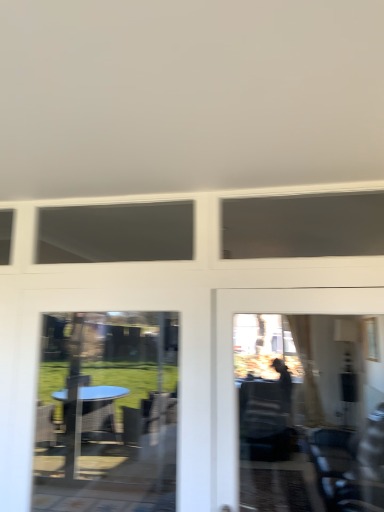
Question: Which is correct: transparent glass table at lower left is inside matte glass door at right, or outside of it?

Choices:
 (A) outside
 (B) inside

Answer: (A)

Question: Considering the positions of transparent glass table at lower left and matte glass door at right in the image, is transparent glass table at lower left bigger or smaller than matte glass door at right?

Choices:
 (A) big
 (B) small

Answer: (B)

Question: Visually, is transparent glass table at lower left positioned to the left or to the right of matte glass door at right?

Choices:
 (A) left
 (B) right

Answer: (A)

Question: From the image's perspective, is matte glass door at right positioned above or below transparent glass table at lower left?

Choices:
 (A) below
 (B) above

Answer: (B)

Question: Considering the positions of matte glass door at right and transparent glass table at lower left in the image, is matte glass door at right taller or shorter than transparent glass table at lower left?

Choices:
 (A) tall
 (B) short

Answer: (B)

Question: Is matte glass door at right wider or thinner than transparent glass table at lower left?

Choices:
 (A) thin
 (B) wide

Answer: (B)

Question: Considering their positions, is matte glass door at right located in front of or behind transparent glass table at lower left?

Choices:
 (A) behind
 (B) front

Answer: (B)